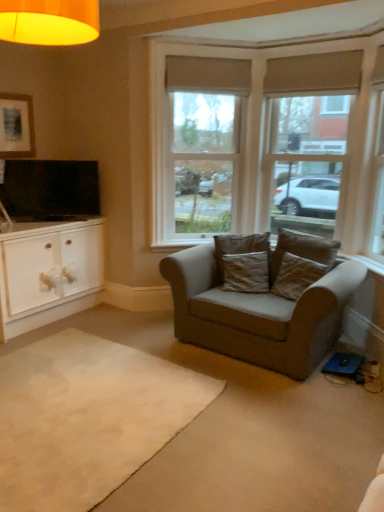
Question: Is point pyautogui.click(x=288, y=262) positioned closer to the camera than point pyautogui.click(x=218, y=266)?

Choices:
 (A) closer
 (B) farther

Answer: (A)

Question: From a real-world perspective, is brown suede pillow at center, arranged as the 2th pillow when viewed from the right, positioned above or below brown fabric pillow at center, placed as the third pillow when sorted from right to left?

Choices:
 (A) below
 (B) above

Answer: (A)

Question: Which is farther from the brown suede pillow at center, positioned as the first pillow in right-to-left order?

Choices:
 (A) matte black picture frame at upper left
 (B) flat screen tv at left
 (C) white wood window at center, the second window when ordered from right to left
 (D) brown fabric pillow at center, placed as the third pillow when sorted from right to left
 (E) beige carpet at lower center

Answer: (A)

Question: Which of these objects is positioned closest to the brown suede pillow at center, placed as the 3th pillow when sorted from left to right?

Choices:
 (A) brown fabric pillow at center, placed as the third pillow when sorted from right to left
 (B) white wood window at center, the first window positioned from the left
 (C) beige carpet at lower center
 (D) brown suede pillow at center, which appears as the second pillow when viewed from the left
 (E) suede gray couch at center

Answer: (D)